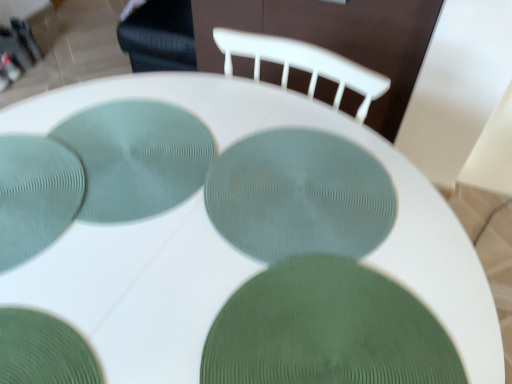
This screenshot has height=384, width=512. In order to click on vacant space situated on the left part of green textured plate at center, the 5th glass plate positioned from the left in this screenshot , I will do `click(121, 283)`.